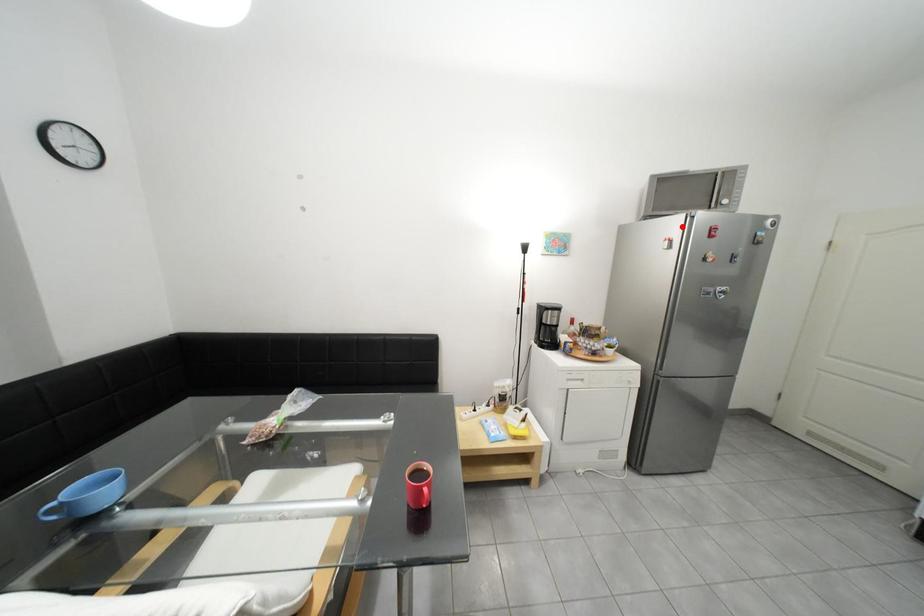
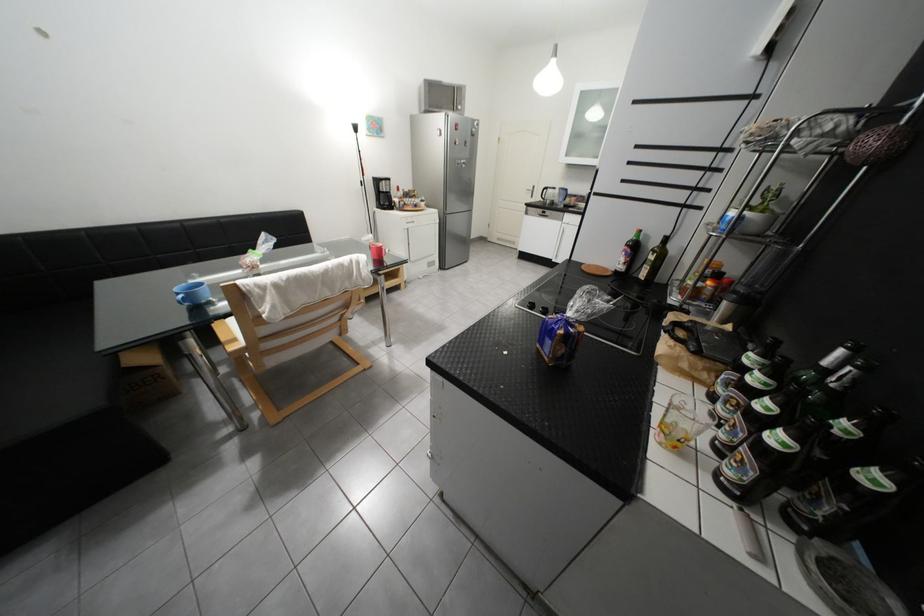
Locate, in the second image, the point that corresponds to the highlighted location in the first image.

(451, 121)